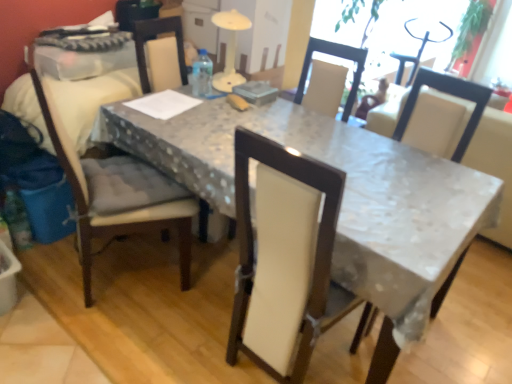
The image size is (512, 384). I want to click on vacant space underneath matte beige cushioned chair at left, the 2th chair when ordered from right to left (from a real-world perspective), so point(106,281).